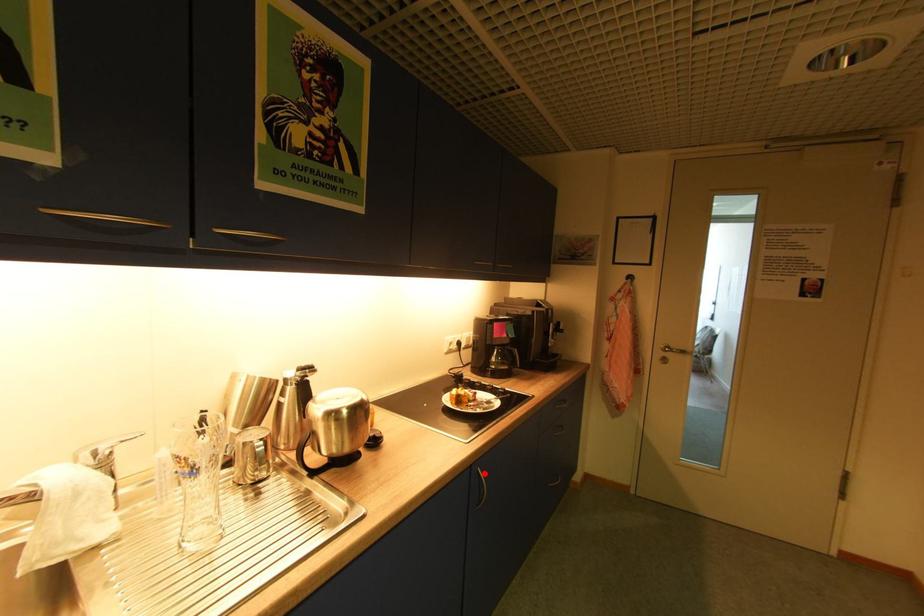
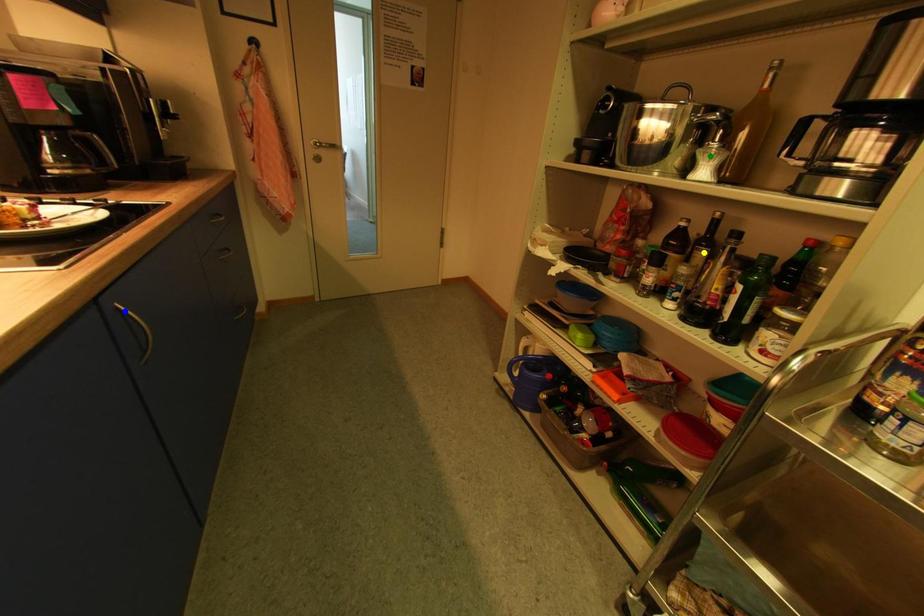
Question: I am providing you with two images of the same scene from different viewpoints. A red point is marked on the first image. You are given multiple points on the second image. Which mark in image 2 goes with the point in image 1?

Choices:
 (A) green point
 (B) yellow point
 (C) blue point

Answer: (C)